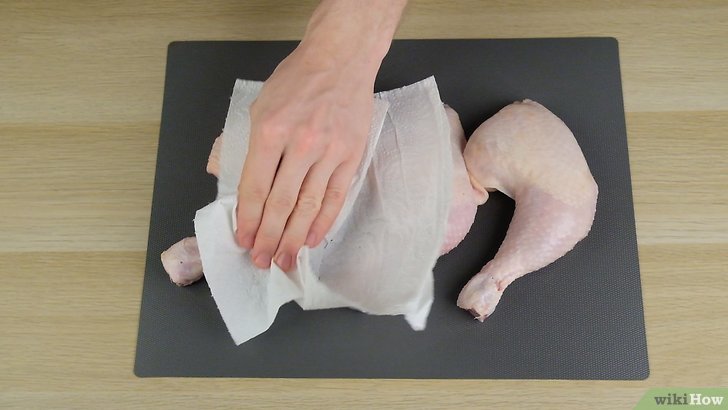
Where is `napkin`? The image size is (728, 410). napkin is located at coordinates (403, 194).